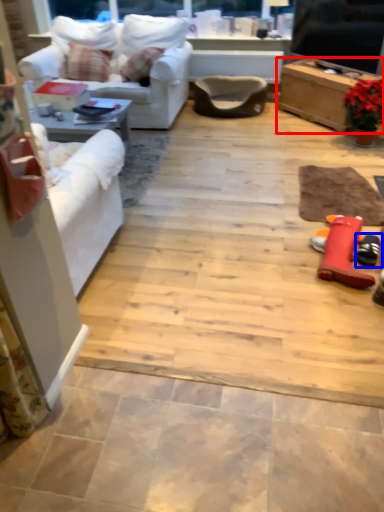
Question: Among these objects, which one is farthest to the camera, table (highlighted by a red box) or footwear (highlighted by a blue box)?

Choices:
 (A) table
 (B) footwear

Answer: (A)